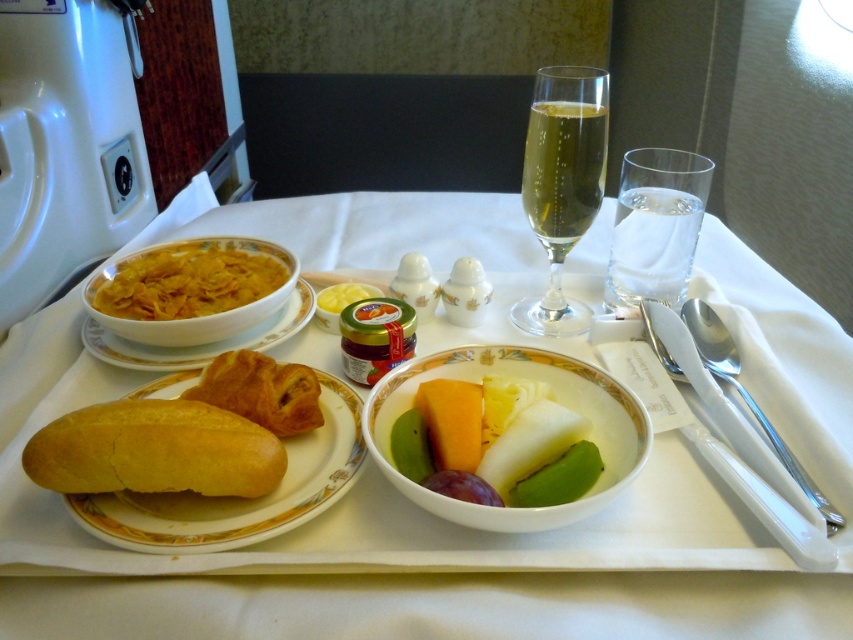
Question: Which of the following is the farthest from the observer?

Choices:
 (A) (122, 364)
 (B) (233, 355)

Answer: (A)

Question: Which object appears closest to the camera in this image?

Choices:
 (A) yellow cornflakes at upper left
 (B) golden crusty croissant at lower left
 (C) white glossy bowl at center
 (D) clear glass water at upper right

Answer: (C)

Question: Is golden crusty croissant at lower left bigger than golden flaky croissant at center left?

Choices:
 (A) no
 (B) yes

Answer: (B)

Question: Is golden crusty croissant at lower left positioned before yellow cornflakes at upper left?

Choices:
 (A) yes
 (B) no

Answer: (A)

Question: Can you confirm if yellow cornflakes at upper left is thinner than golden flaky croissant at center left?

Choices:
 (A) no
 (B) yes

Answer: (A)

Question: Which object is positioned farthest from the matte porcelain bowl at upper left?

Choices:
 (A) golden flaky croissant at center left
 (B) clear glass water at upper right
 (C) white porcelain tray at center
 (D) golden bread at lower left

Answer: (B)